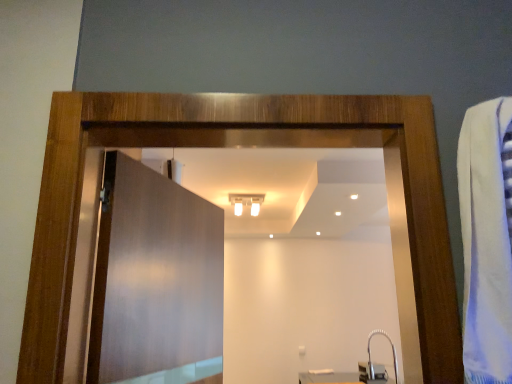
Question: Considering the positions of satin nickel faucet at lower right and matte wood door at center in the image, is satin nickel faucet at lower right taller or shorter than matte wood door at center?

Choices:
 (A) tall
 (B) short

Answer: (B)

Question: Is satin nickel faucet at lower right inside the boundaries of matte wood door at center, or outside?

Choices:
 (A) inside
 (B) outside

Answer: (B)

Question: Which object is positioned closest to the white glossy light fixture at upper center?

Choices:
 (A) matte wood door at center
 (B) satin nickel faucet at lower right

Answer: (B)

Question: Estimate the real-world distances between objects in this image. Which object is closer to the white glossy light fixture at upper center?

Choices:
 (A) matte wood door at center
 (B) satin nickel faucet at lower right

Answer: (B)